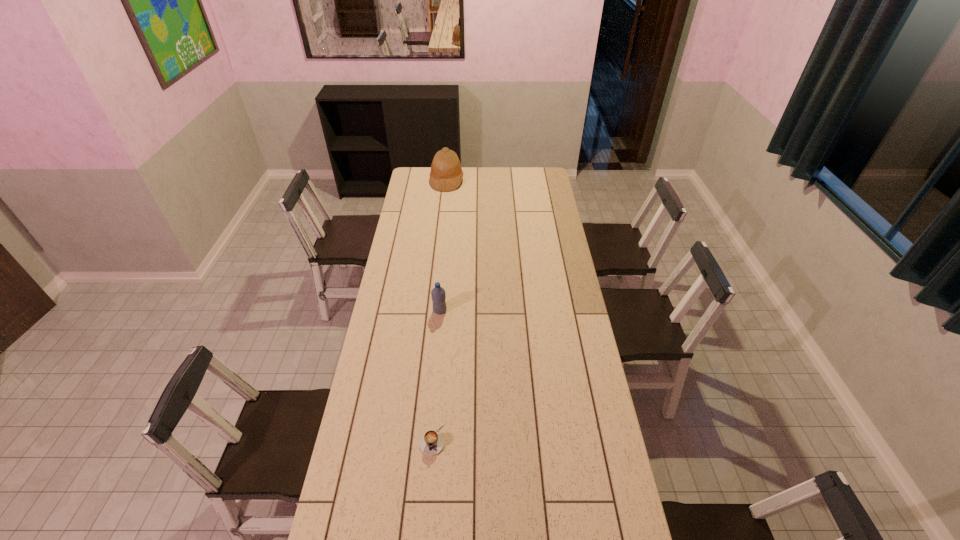
Where is `object that ranks as the closest to the shortest object`? object that ranks as the closest to the shortest object is located at coordinates (438, 295).

The width and height of the screenshot is (960, 540). What are the coordinates of `object that stands as the second closest to the farthest object` in the screenshot? It's located at (431, 443).

Identify the location of free space that satisfies the following two spatial constraints: 1. on the front-facing side of the tallest object; 2. on the left side of the water bottle. Image resolution: width=960 pixels, height=540 pixels. (433, 310).

Find the location of a particular element. Image resolution: width=960 pixels, height=540 pixels. free location that satisfies the following two spatial constraints: 1. on the front-facing side of the second tallest object; 2. on the right side of the farthest object is located at coordinates (433, 310).